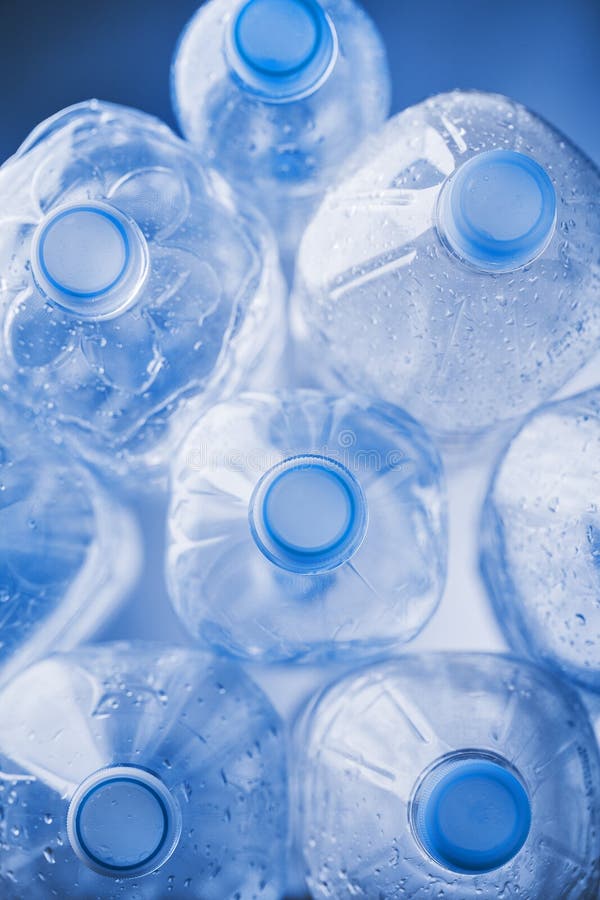
Find the location of a particular element. Image resolution: width=600 pixels, height=900 pixels. water bottles put on their side is located at coordinates (120, 790), (417, 812), (49, 544), (270, 542), (531, 529), (494, 213), (90, 250), (278, 51).